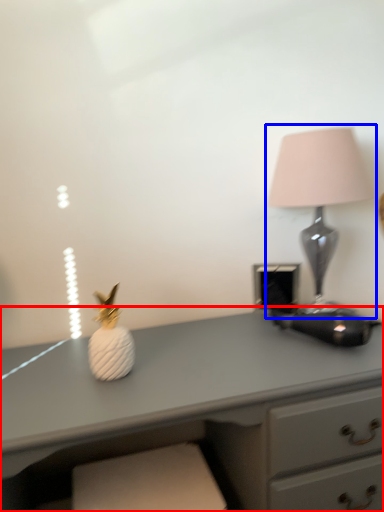
Question: Among these objects, which one is nearest to the camera, desk (highlighted by a red box) or lamp (highlighted by a blue box)?

Choices:
 (A) desk
 (B) lamp

Answer: (A)